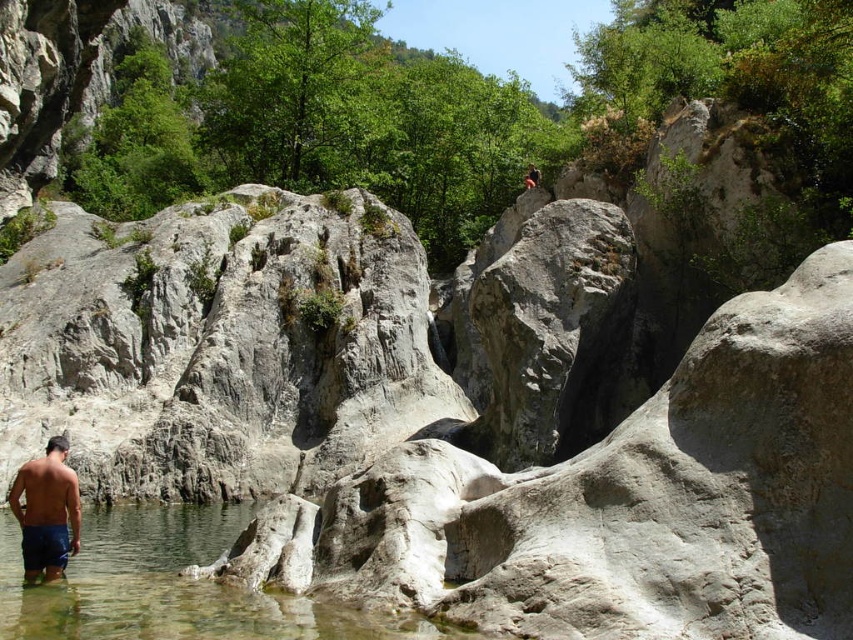
You are standing in the rocky landscape scene and want to place a small flag at the point that is closer to you. Which point should you choose between point (39, 602) and point (33, 532)?

You should choose point (39, 602) because it is closer to the camera than point (33, 532).

You are standing in the rocky landscape and notice the clear water at lower left and the blue denim shorts at lower left. Which object is positioned lower in the scene?

Answer: The clear water at lower left is located below the blue denim shorts at lower left, so it is positioned lower in the scene.